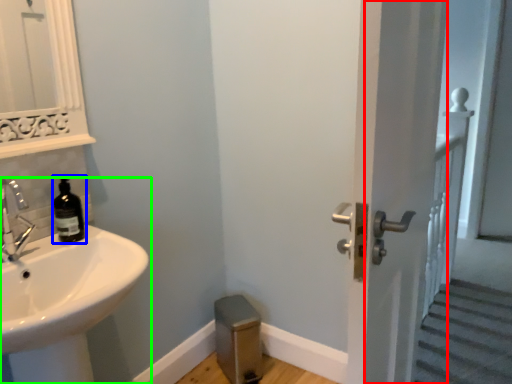
Question: Considering the real-world distances, which object is farthest from screen door (highlighted by a red box)? bottle (highlighted by a blue box) or sink (highlighted by a green box)?

Choices:
 (A) bottle
 (B) sink

Answer: (A)